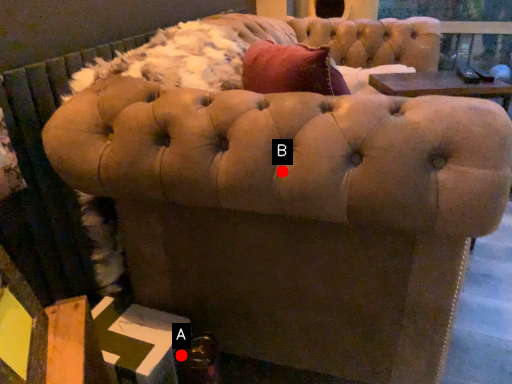
Question: Two points are circled on the image, labeled by A and B beside each circle. Which point appears farthest from the camera in this image?

Choices:
 (A) A is further
 (B) B is further

Answer: (A)